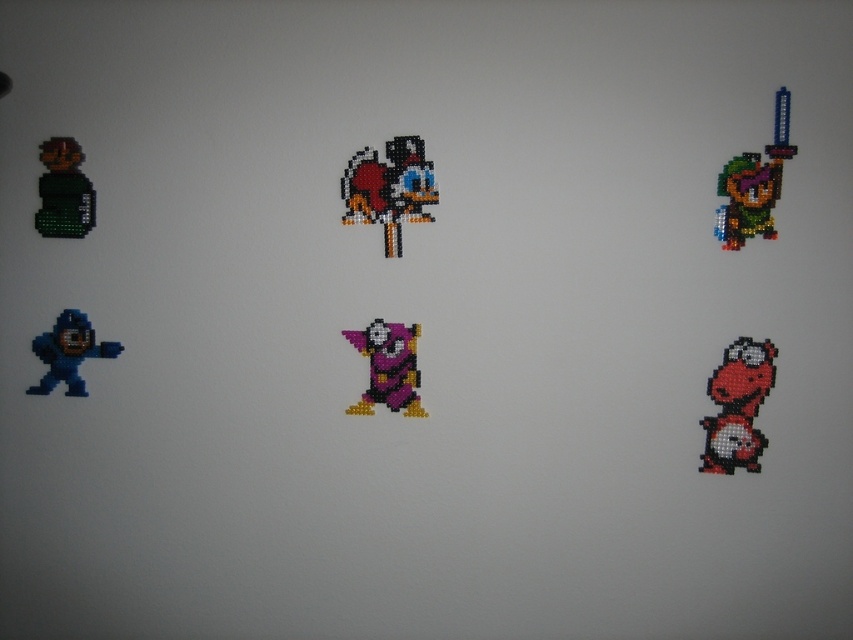
Question: Can you confirm if pixelated yellow duck at center is bigger than purple matte jester at center?

Choices:
 (A) yes
 (B) no

Answer: (A)

Question: Does multicolored beaded figure at upper right lie behind matte green figure at upper left?

Choices:
 (A) no
 (B) yes

Answer: (A)

Question: Which of the following is the farthest from the observer?

Choices:
 (A) blue matte astronaut at lower left
 (B) matte red dog at lower right
 (C) purple matte jester at center

Answer: (A)

Question: Which point is farther from the camera taking this photo?

Choices:
 (A) (74, 161)
 (B) (727, 445)
 (C) (68, 392)

Answer: (C)

Question: Estimate the real-world distances between objects in this image. Which object is farther from the pixelated yellow duck at center?

Choices:
 (A) matte red dog at lower right
 (B) multicolored beaded figure at upper right
 (C) matte green figure at upper left

Answer: (A)

Question: Is multicolored beaded figure at upper right positioned before purple matte jester at center?

Choices:
 (A) yes
 (B) no

Answer: (A)